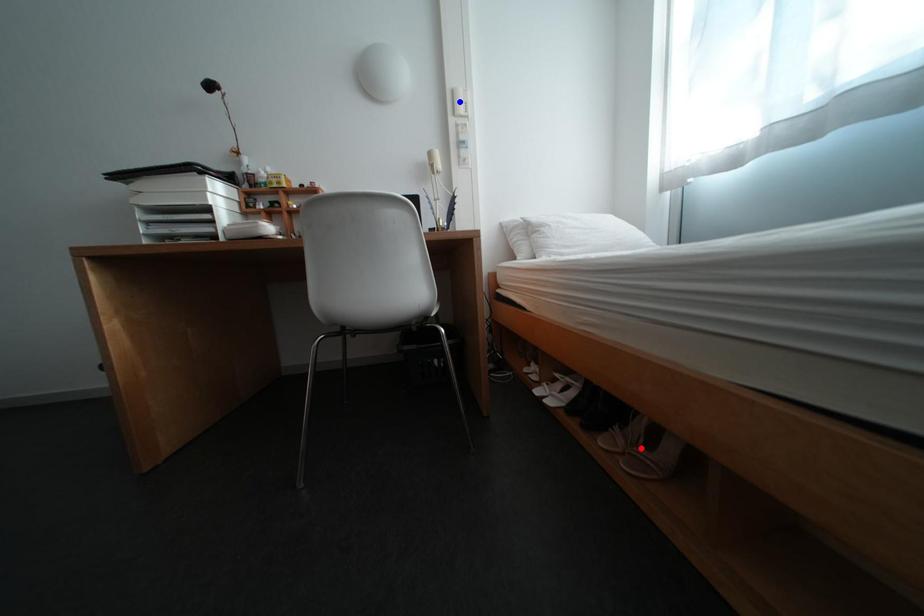
Question: Which of the two points in the image is closer to the camera?

Choices:
 (A) Blue point is closer.
 (B) Red point is closer.

Answer: (B)